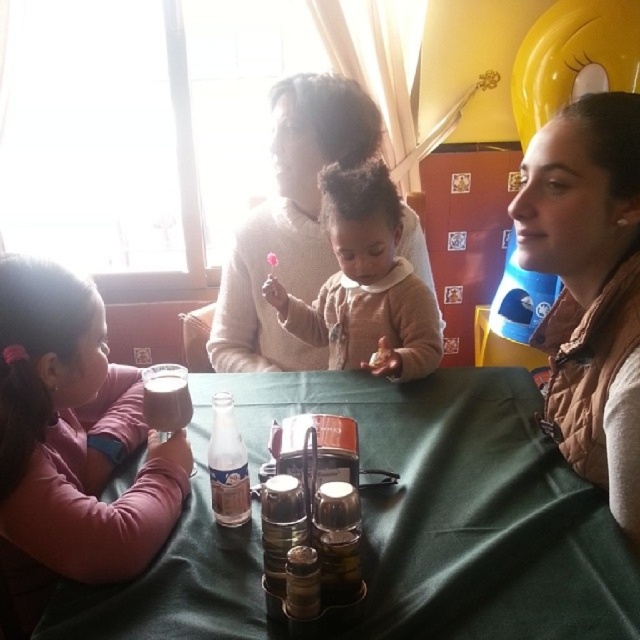
Question: Which object appears closest to the camera in this image?

Choices:
 (A) pink fabric shirt at left
 (B) brown quilted vest at right
 (C) soft beige sweater at center
 (D) green fabric table at center

Answer: (D)

Question: Based on their relative distances, which object is farther from the soft beige sweater at center?

Choices:
 (A) brown quilted vest at right
 (B) pink fabric shirt at left

Answer: (B)

Question: Does green fabric table at center have a smaller size compared to pink fabric shirt at left?

Choices:
 (A) yes
 (B) no

Answer: (B)

Question: Is green fabric table at center positioned before pink fabric shirt at left?

Choices:
 (A) no
 (B) yes

Answer: (B)

Question: Which point appears farthest from the camera in this image?

Choices:
 (A) (68, 500)
 (B) (424, 310)

Answer: (B)

Question: Is brown quilted vest at right wider than soft beige sweater at center?

Choices:
 (A) no
 (B) yes

Answer: (A)